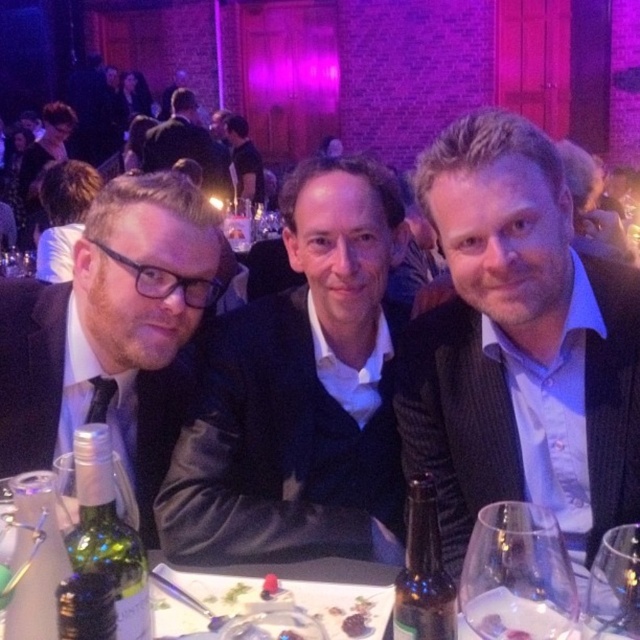
Question: Estimate the real-world distances between objects in this image. Which object is closer to the green glass bottle at lower left?

Choices:
 (A) green glass bottle at center
 (B) matte black shirt at center

Answer: (A)

Question: Considering the relative positions of matte black suit at left and transparent glass at center in the image provided, where is matte black suit at left located with respect to transparent glass at center?

Choices:
 (A) below
 (B) above

Answer: (B)

Question: Among these points, which one is nearest to the camera?

Choices:
 (A) (84, 433)
 (B) (627, 563)
 (C) (572, 486)
 (D) (163, 125)

Answer: (B)

Question: Among these objects, which one is farthest from the camera?

Choices:
 (A) matte black shirt at center
 (B) green glass bottle at center

Answer: (A)

Question: Is matte black suit at center above green glass bottle at lower left?

Choices:
 (A) yes
 (B) no

Answer: (A)

Question: Does green glass bottle at lower left appear on the left side of dark brown leather jacket at center?

Choices:
 (A) yes
 (B) no

Answer: (B)